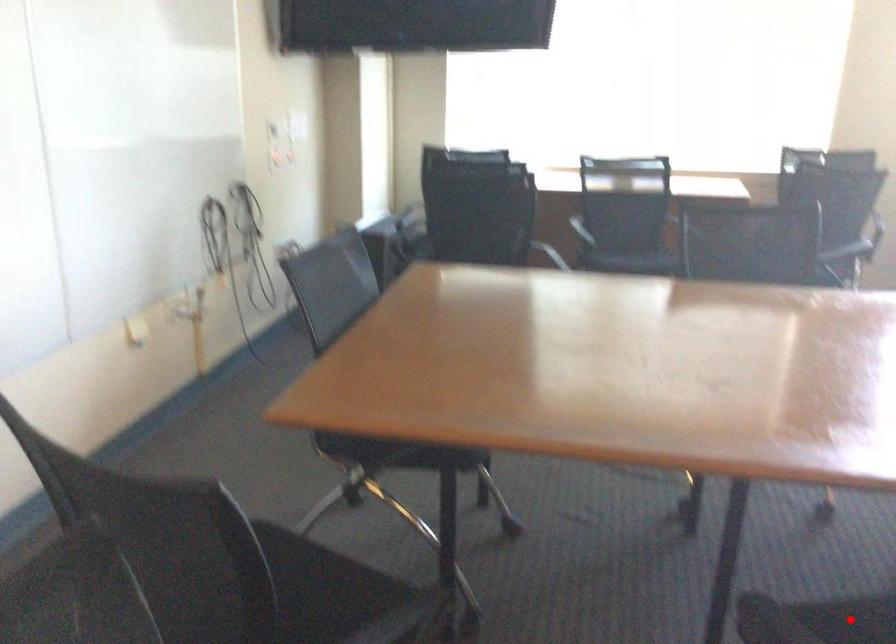
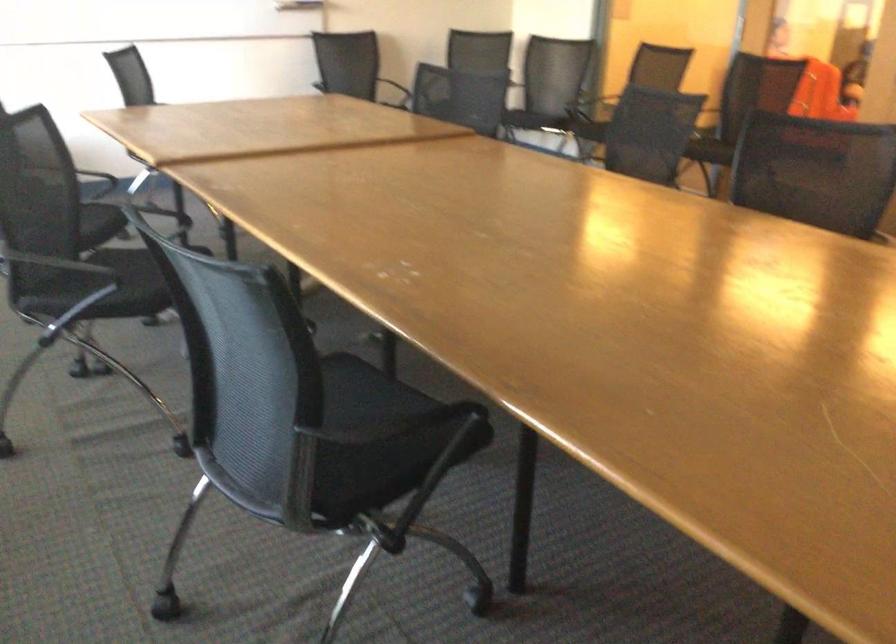
Question: I am providing you with two images of the same scene from different viewpoints. A red point is marked on the first image. Is the red point's position out of view in image 2?

Choices:
 (A) Yes
 (B) No

Answer: (A)